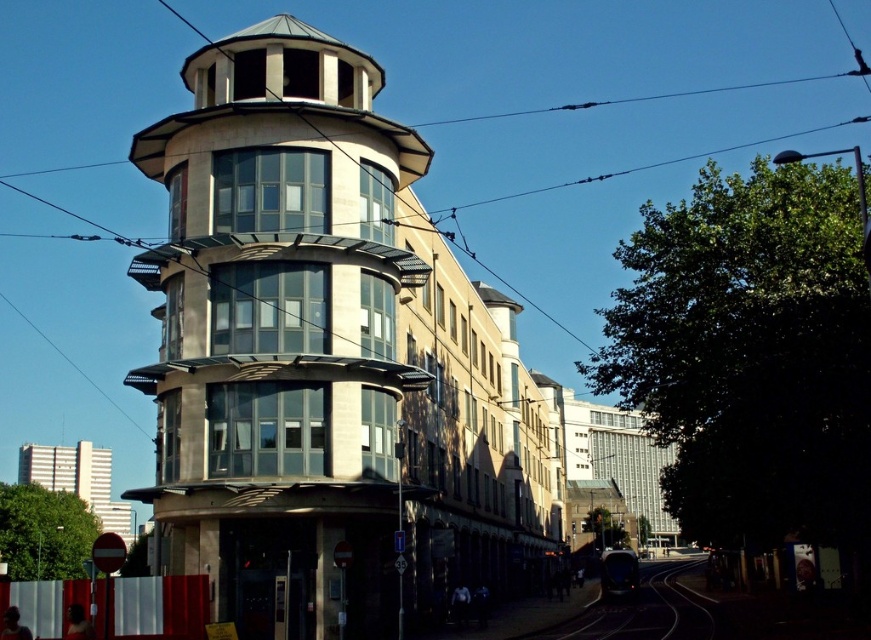
You are standing at the corner of the street looking at the modern building. You notice two points marked on the building facade. The first point is at coordinates point (x=181, y=244) and the second is at point (x=665, y=604). Which of these two points is closer to you as you stand at the corner?

Point (x=181, y=244) is in front of point (x=665, y=604), so it is closer to you as you stand at the corner.

You are standing at the camera position and want to take a photo of the matte glass bell tower at center. The camera has a maximum focus range of 60 meters. Will you be able to capture the tower clearly?

The matte glass bell tower at center and camera are 64.20 meters apart from each other. Since the distance exceeds the camera maximum focus range of 60 meters, you won answer